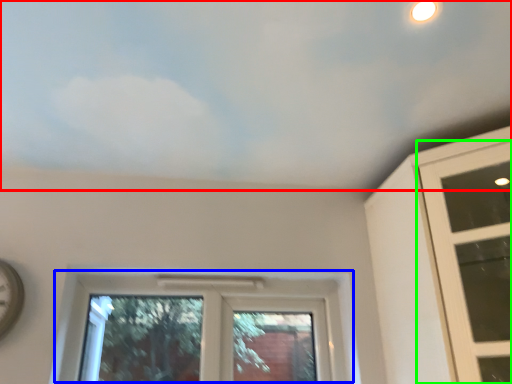
Question: Which object is the farthest from cloud (highlighted by a red box)? Choose among these: window (highlighted by a blue box) or window (highlighted by a green box).

Choices:
 (A) window
 (B) window

Answer: (A)